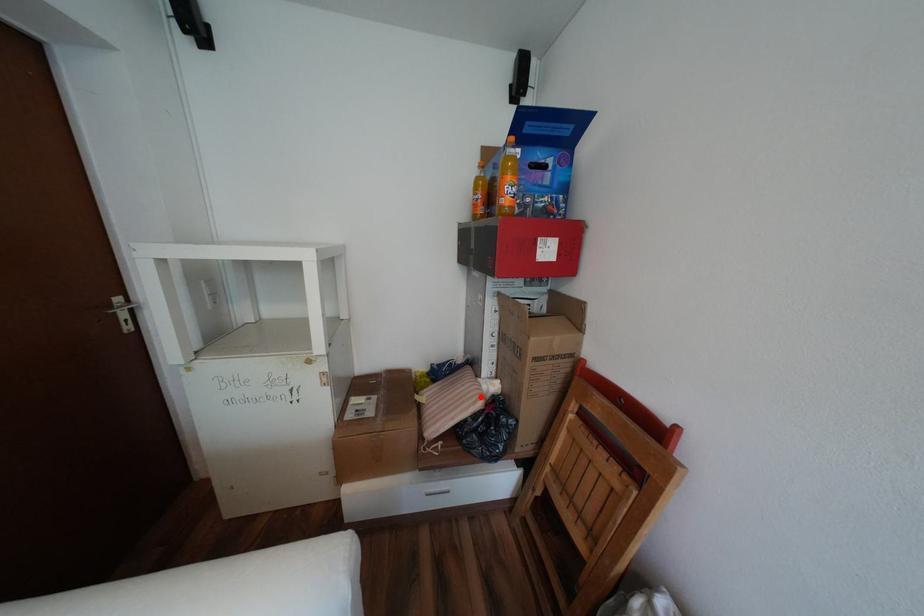
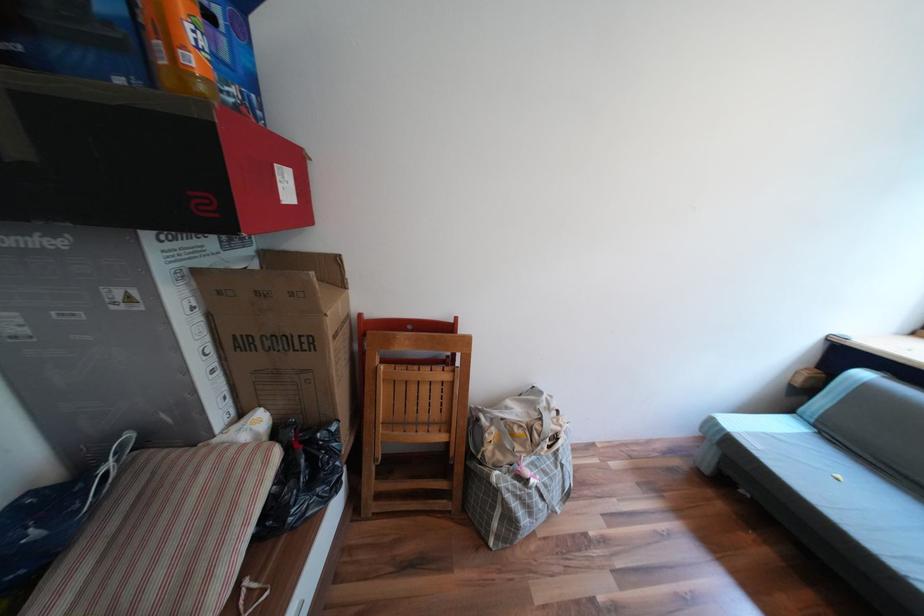
The point at the highlighted location is marked in the first image. Where is the corresponding point in the second image?

(258, 464)